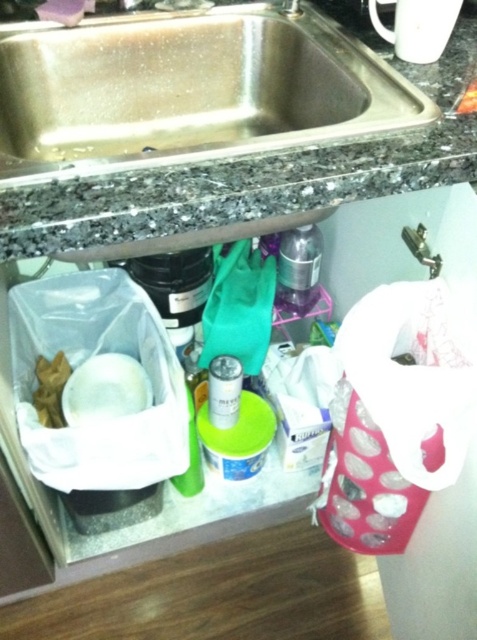
Based on the photo, you are a kitchen assistant who needs to reach the metallic silver can at center without touching the stainless steel sink at upper center. Is this possible given their positions?

The stainless steel sink at upper center is closer to the viewer than the metallic silver can at center, so you can reach the metallic silver can at center without touching the sink by moving around it or bending down to access the can behind the sink.

You are organizing the kitchen under the sink. You need to place a new metallic silver can at center to the right of the stainless steel sink at upper center. Is the current arrangement already meeting this requirement?

Yes, the current arrangement already meets the requirement because the stainless steel sink at upper center is to the left of the metallic silver can at center, so the metallic silver can at center is already positioned to the right of the stainless steel sink at upper center.